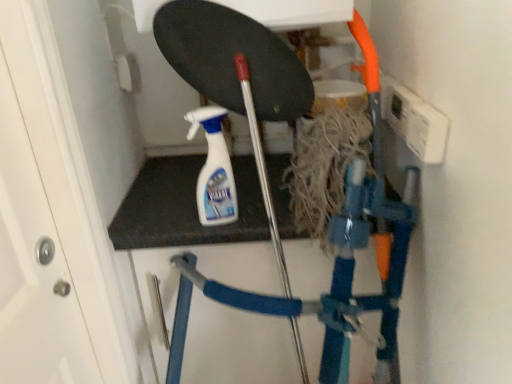
Find the location of `free spot above blue plastic ladder at center (from a real-world perspective)`. free spot above blue plastic ladder at center (from a real-world perspective) is located at coordinates (189, 187).